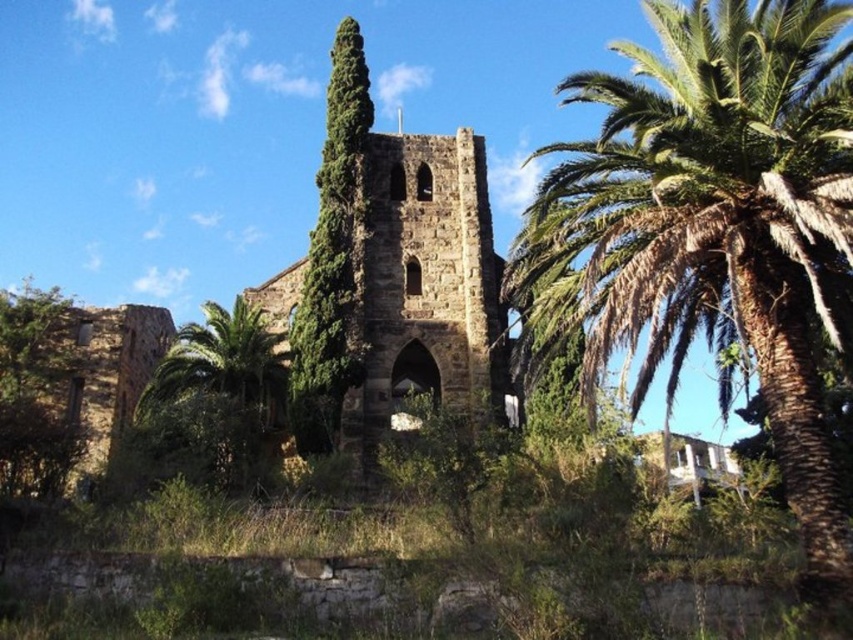
In the scene shown: Is green leafy palm tree at right positioned in front of brown stone church at center?

Yes, green leafy palm tree at right is closer to the viewer.

Based on the photo, between green leafy palm tree at right and brown stone church at center, which one has more height?

green leafy palm tree at right is taller.

Describe the element at coordinates (718, 221) in the screenshot. I see `green leafy palm tree at right` at that location.

Locate an element on the screen. This screenshot has height=640, width=853. green leafy palm tree at right is located at coordinates (718, 221).

Is the position of green leafy tree at center more distant than that of green leafy palm tree at center?

Yes, green leafy tree at center is further from the viewer.

Is point (326, 97) farther from viewer compared to point (235, 428)?

Yes.

Between point (294, 396) and point (245, 346), which one is positioned in front?

Point (294, 396) is in front.

I want to click on green leafy tree at center, so click(332, 257).

Who is shorter, green leafy palm tree at center or green leafy tree at left?

green leafy palm tree at center

Can you confirm if green leafy palm tree at center is taller than green leafy tree at left?

Incorrect, green leafy palm tree at center's height is not larger of green leafy tree at left's.

Between point (167, 390) and point (45, 372), which one is positioned in front?

Point (167, 390)

The image size is (853, 640). In order to click on green leafy palm tree at center in this screenshot , I will do `click(219, 394)`.